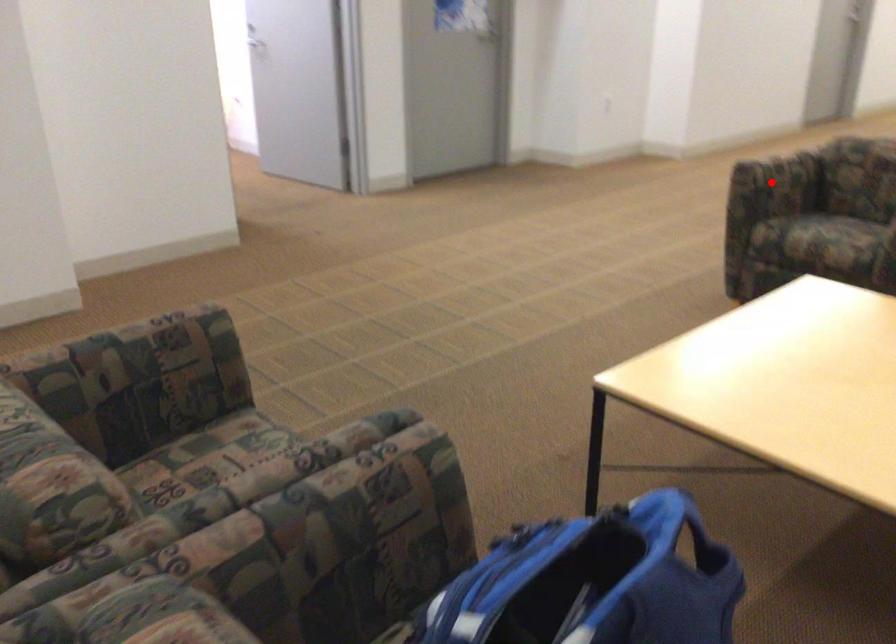
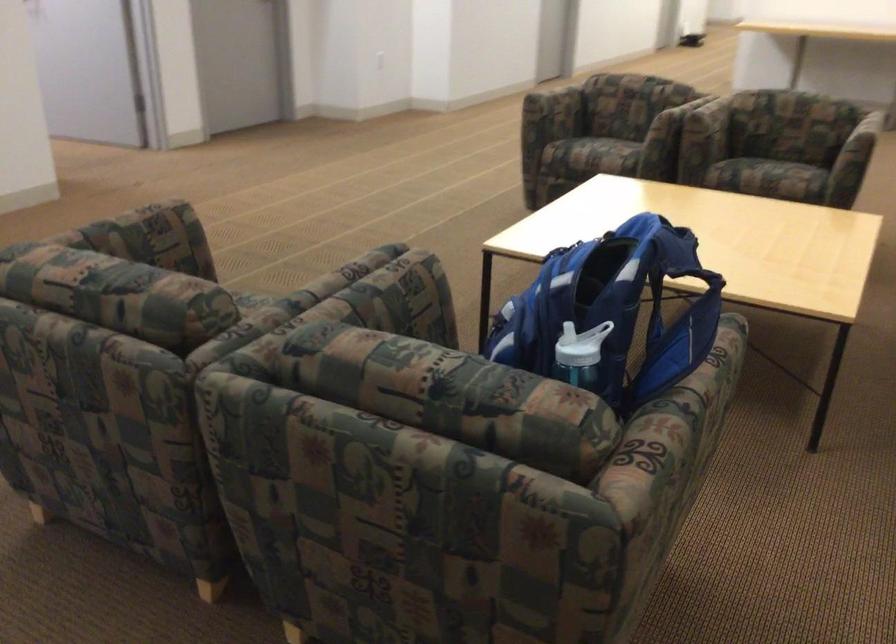
Question: I am providing you with two images of the same scene from different viewpoints. In image1, a red point is highlighted. Considering the same 3D point in image2, which of the following is correct?

Choices:
 (A) It is closer
 (B) It is farther

Answer: (B)